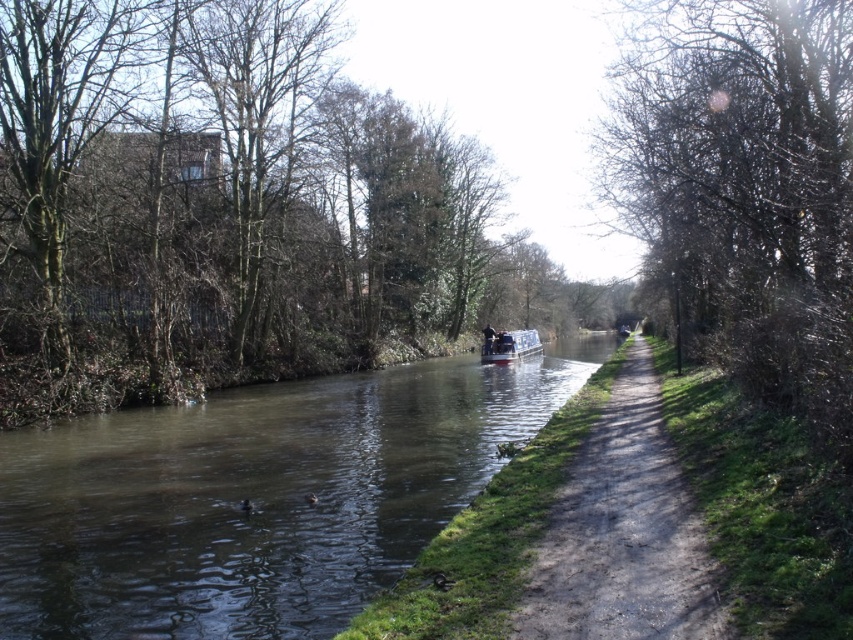
Question: In this image, where is greenish reflective water at center located relative to dirt path at right?

Choices:
 (A) left
 (B) right

Answer: (A)

Question: Observing the image, what is the correct spatial positioning of greenish reflective water at center in reference to dirt path at right?

Choices:
 (A) right
 (B) left

Answer: (B)

Question: Which of the following is the farthest from the observer?

Choices:
 (A) dirt path at right
 (B) white plastic boat at center

Answer: (B)

Question: Which point is farther to the camera?

Choices:
 (A) (491, 333)
 (B) (506, 337)

Answer: (A)

Question: Does dirt path at right have a lesser width compared to dark blue fabric boat at center?

Choices:
 (A) yes
 (B) no

Answer: (B)

Question: Which of these objects is positioned closest to the dark blue fabric boat at center?

Choices:
 (A) bare branches at right
 (B) dirt path at right

Answer: (A)